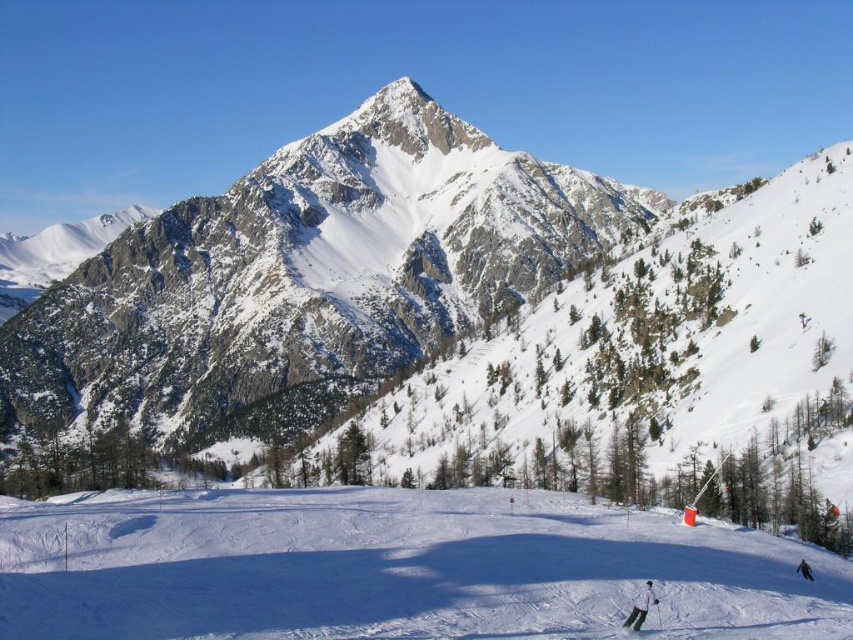
You are a photographer planning to take a photo of the snowy granite mountain at upper center and the white snow ski slope at center. Based on their positions, which object should you place on the left side of your photo frame?

The snowy granite mountain at upper center should be placed on the left side of the photo frame because it is to the left of the white snow ski slope at center.

You are standing at the top of the ski slope and see the point marked at coordinates (x=640, y=605). Based on the scene, what object is this point located on?

The point is located on the white matte jacket at lower right.

You are a mountain guide planning a ski route. You need to know the distance between the snowy granite mountain at upper center and the white snow ski slope at center. Can you confirm if it is over 80 meters?

The distance between the snowy granite mountain at upper center and the white snow ski slope at center is 89.60 meters, which is over 80 meters.